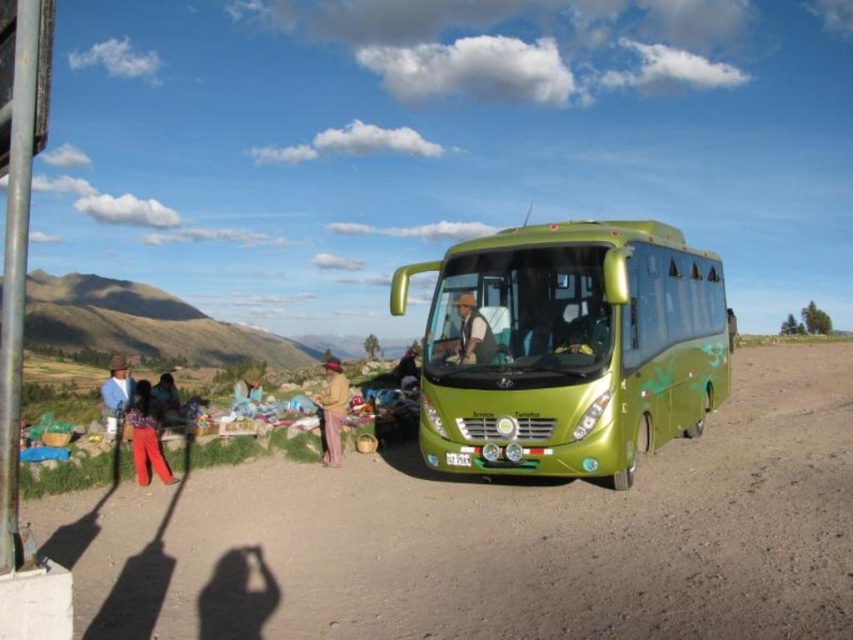
Question: Where is green rubber dirt track at center located in relation to blue denim jacket at left in the image?

Choices:
 (A) above
 (B) below

Answer: (B)

Question: Does green rubber dirt track at center have a smaller size compared to matte brown jacket at lower left?

Choices:
 (A) yes
 (B) no

Answer: (A)

Question: Can you confirm if matte green bus at center is wider than blue denim jacket at left?

Choices:
 (A) no
 (B) yes

Answer: (A)

Question: Among these objects, which one is farthest from the camera?

Choices:
 (A) green metallic bus at center
 (B) matte red pants at lower left
 (C) brown woven hat at center

Answer: (C)

Question: Which object appears closest to the camera in this image?

Choices:
 (A) green rubber dirt track at center
 (B) matte red pants at lower left
 (C) matte green bus at center

Answer: (A)

Question: Which of the following is the farthest from the observer?

Choices:
 (A) (457, 340)
 (B) (151, 416)
 (C) (103, 387)

Answer: (B)